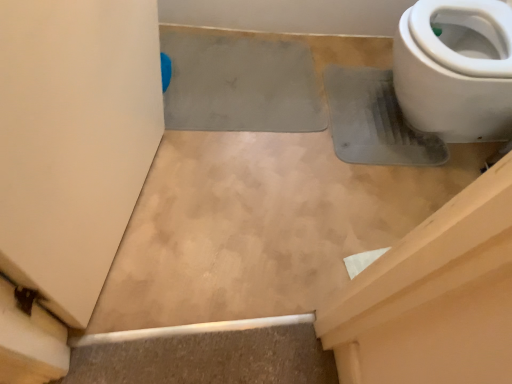
Question: Is white glossy toilet at upper right situated inside gray rubber mat at center or outside?

Choices:
 (A) inside
 (B) outside

Answer: (B)

Question: Considering the relative positions of white glossy toilet at upper right and gray rubber mat at center in the image provided, is white glossy toilet at upper right to the left or to the right of gray rubber mat at center?

Choices:
 (A) left
 (B) right

Answer: (B)

Question: From their relative heights in the image, would you say white glossy toilet at upper right is taller or shorter than gray rubber mat at center?

Choices:
 (A) short
 (B) tall

Answer: (B)

Question: Is point (184, 72) closer or farther from the camera than point (398, 104)?

Choices:
 (A) farther
 (B) closer

Answer: (A)

Question: From a real-world perspective, is gray rubber mat at center above or below white glossy toilet at upper right?

Choices:
 (A) below
 (B) above

Answer: (A)

Question: From the image's perspective, is gray rubber mat at center positioned above or below white glossy toilet at upper right?

Choices:
 (A) below
 (B) above

Answer: (A)

Question: Is gray rubber mat at center inside the boundaries of white glossy toilet at upper right, or outside?

Choices:
 (A) inside
 (B) outside

Answer: (B)